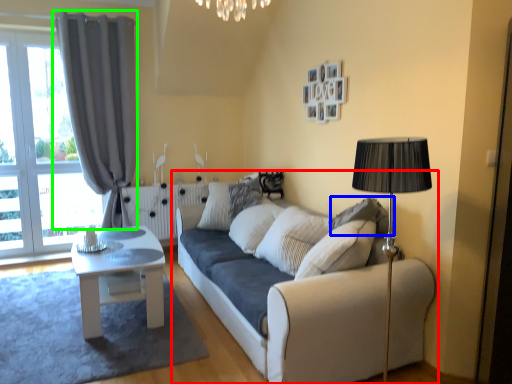
Question: Which object is positioned closest to studio couch (highlighted by a red box)? Select from pillow (highlighted by a blue box) and curtain (highlighted by a green box).

Choices:
 (A) pillow
 (B) curtain

Answer: (A)